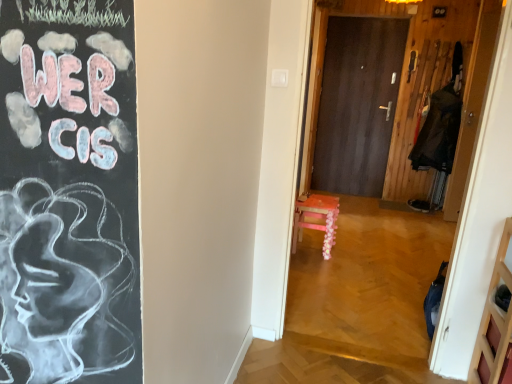
Question: Considering the relative sizes of wooden door at right, placed as the second door when sorted from left to right, and dark blue fabric coat at right in the image provided, is wooden door at right, placed as the second door when sorted from left to right, wider than dark blue fabric coat at right?

Choices:
 (A) yes
 (B) no

Answer: (B)

Question: From a real-world perspective, is wooden door at right, placed as the second door when sorted from left to right, located higher than dark blue fabric coat at right?

Choices:
 (A) yes
 (B) no

Answer: (A)

Question: From a real-world perspective, is wooden door at right, which appears as the 2th door when viewed from the back, below dark blue fabric coat at right?

Choices:
 (A) no
 (B) yes

Answer: (A)

Question: Is wooden door at right, which is counted as the first door, starting from the front, facing towards dark blue fabric coat at right?

Choices:
 (A) no
 (B) yes

Answer: (A)

Question: Is wooden door at right, which is the 1th door from right to left, smaller than dark blue fabric coat at right?

Choices:
 (A) no
 (B) yes

Answer: (B)

Question: From the image's perspective, is dark wood door at center, positioned as the 1th door in back-to-front order, positioned above or below dark blue fabric coat at right?

Choices:
 (A) above
 (B) below

Answer: (A)

Question: From a real-world perspective, is dark wood door at center, the 2th door positioned from the front, physically located above or below dark blue fabric coat at right?

Choices:
 (A) below
 (B) above

Answer: (B)

Question: Which is correct: dark wood door at center, the 2th door positioned from the front, is inside dark blue fabric coat at right, or outside of it?

Choices:
 (A) outside
 (B) inside

Answer: (A)

Question: Based on their positions, is dark wood door at center, positioned as the 1th door in back-to-front order, located to the left or right of dark blue fabric coat at right?

Choices:
 (A) right
 (B) left

Answer: (B)

Question: In terms of width, does dark blue fabric coat at right look wider or thinner when compared to wooden floral-patterned stool at center?

Choices:
 (A) wide
 (B) thin

Answer: (A)

Question: Is dark blue fabric coat at right in front of or behind wooden floral-patterned stool at center in the image?

Choices:
 (A) front
 (B) behind

Answer: (B)

Question: Would you say dark blue fabric coat at right is to the left or to the right of wooden floral-patterned stool at center in the picture?

Choices:
 (A) left
 (B) right

Answer: (B)

Question: Considering the positions of dark blue fabric coat at right and wooden floral-patterned stool at center in the image, is dark blue fabric coat at right bigger or smaller than wooden floral-patterned stool at center?

Choices:
 (A) small
 (B) big

Answer: (B)

Question: From the image's perspective, relative to dark wood door at center, positioned as the second door in right-to-left order, is dark blue fabric coat at right above or below?

Choices:
 (A) above
 (B) below

Answer: (B)

Question: Is dark blue fabric coat at right spatially inside dark wood door at center, positioned as the second door in right-to-left order, or outside of it?

Choices:
 (A) outside
 (B) inside

Answer: (A)